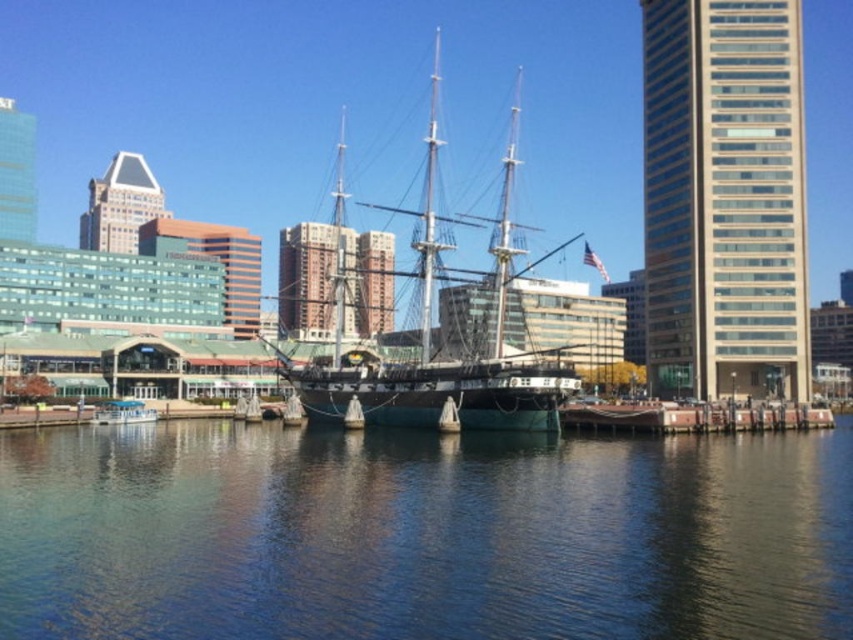
You are a photographer planning to capture a wide shot of the waterfront scene. You need to ensure that both the blue water at center and the green wooden boat at lower center are clearly visible. Given their sizes, which object should you prioritize framing closer to the center of your photo to maintain their visibility?

The blue water at center has a larger size compared to the green wooden boat at lower center. To maintain visibility of both, prioritize framing the blue water at center closer to the center of the photo since its larger size will allow it to be more prominent and easier to capture clearly even at a distance.

You are a photographer planning to capture the historic sailing ship and its surroundings. You want to ensure the green wooden boat at lower center is visible in the reflection of the blue water at center. Is this possible based on their positions?

The blue water at center is positioned under the green wooden boat at lower center, so the boat is likely above the water. Therefore, its reflection would appear on the water surface, making it visible in the reflection.